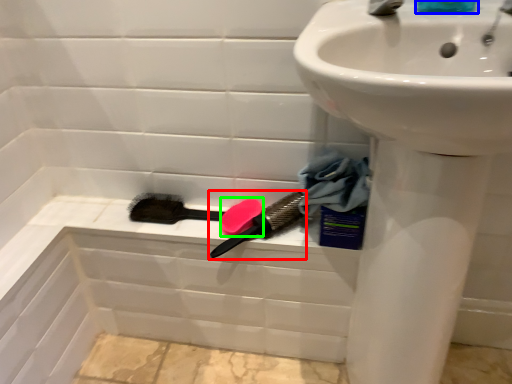
Question: Considering the real-world distances, which object is closest to brush (highlighted by a red box)? liquid (highlighted by a blue box) or soap (highlighted by a green box).

Choices:
 (A) liquid
 (B) soap

Answer: (B)